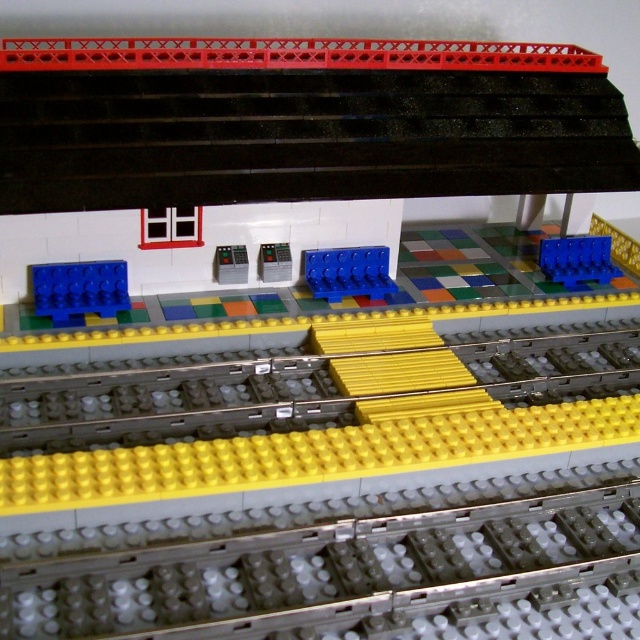
Does blue matte brick at center come in front of metallic gray control panel at center?

No, blue matte brick at center is further to the viewer.

Is blue matte brick at center above metallic gray control panel at center?

No.

Between point (321, 289) and point (228, 275), which one is positioned in front?

Point (228, 275) is more forward.

Identify the location of blue matte brick at center. Image resolution: width=640 pixels, height=640 pixels. (348, 273).

Which is in front, point (48, 289) or point (230, 276)?

Point (48, 289) is in front.

Who is shorter, blue matte brick at left or metallic gray control panel at center?

With less height is metallic gray control panel at center.

Find the location of `blue matte brick at left`. blue matte brick at left is located at coordinates (80, 291).

This screenshot has height=640, width=640. Identify the location of blue matte brick at left. (80, 291).

Does blue matte brick at left appear over blue matte brick at center?

No.

Does point (45, 305) lie behind point (307, 257)?

No, it is not.

Where is `blue matte brick at left`? The width and height of the screenshot is (640, 640). blue matte brick at left is located at coordinates (80, 291).